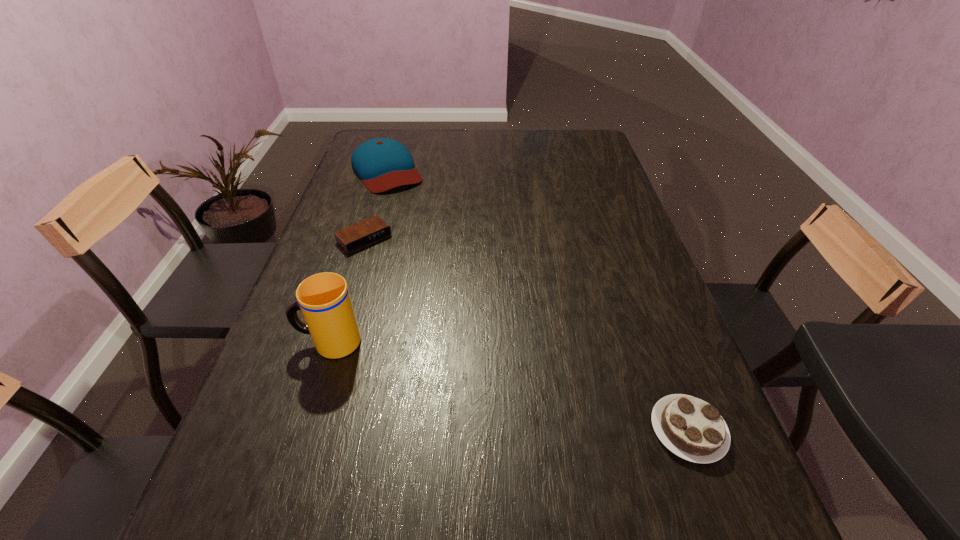
At what (x,y) coordinates should I click in order to perform the action: click on baseball cap that is at the left edge. Please return your answer as a coordinate pair (x, y). Looking at the image, I should click on (382, 164).

The width and height of the screenshot is (960, 540). What are the coordinates of `object present at the right edge` in the screenshot? It's located at (691, 428).

Where is `object at the far left corner`? object at the far left corner is located at coordinates (382, 164).

In order to click on object present at the near right corner in this screenshot , I will do `click(691, 428)`.

Find the location of a particular element. The image size is (960, 540). free space at the far edge of the desktop is located at coordinates (465, 131).

Identify the location of vacant space at the near edge of the desktop. The height and width of the screenshot is (540, 960). (501, 483).

In the image, there is a desktop. At what (x,y) coordinates should I click in order to perform the action: click on vacant space at the left edge. Please return your answer as a coordinate pair (x, y). The height and width of the screenshot is (540, 960). Looking at the image, I should click on (333, 230).

This screenshot has height=540, width=960. I want to click on vacant space at the right edge, so pyautogui.click(x=582, y=221).

Locate an element on the screen. The width and height of the screenshot is (960, 540). vacant area that lies between the second tallest object and the cup is located at coordinates (358, 256).

Where is `free space between the baseball cap and the shortest object`? This screenshot has height=540, width=960. free space between the baseball cap and the shortest object is located at coordinates (375, 205).